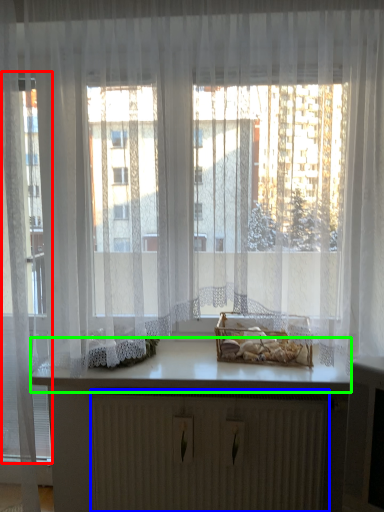
Question: Which is farther away from glass door (highlighted by a red box)? radiator (highlighted by a blue box) or counter top (highlighted by a green box)?

Choices:
 (A) radiator
 (B) counter top

Answer: (A)